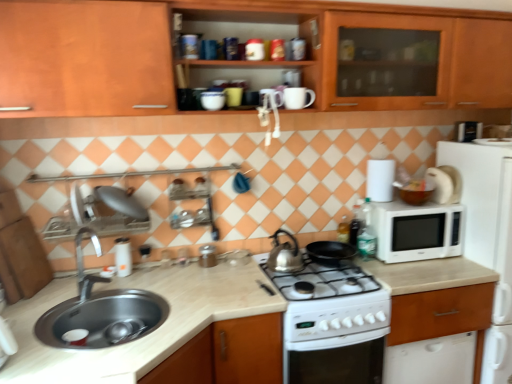
Image resolution: width=512 pixels, height=384 pixels. In order to click on vacant space in front of metallic silver canister at center, which is counted as the 2th appliance, starting from the left in this screenshot , I will do `click(203, 271)`.